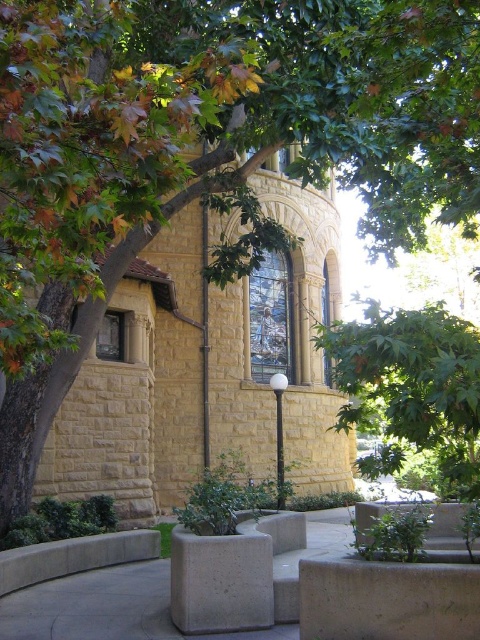
You are a gardener planning to move the gray concrete planter at center closer to the green leafy tree at center. Considering their sizes, will the planter fit entirely within the space currently occupied by the tree?

The green leafy tree at center might be wider than gray concrete planter at center, so there is a possibility that the planter could fit within the tree area, but it depends on the exact dimensions.

You are a visitor approaching the yellow stone church at center and gray concrete planter at center. Which object is higher in elevation?

The yellow stone church at center is located above the gray concrete planter at center, so it is higher in elevation.